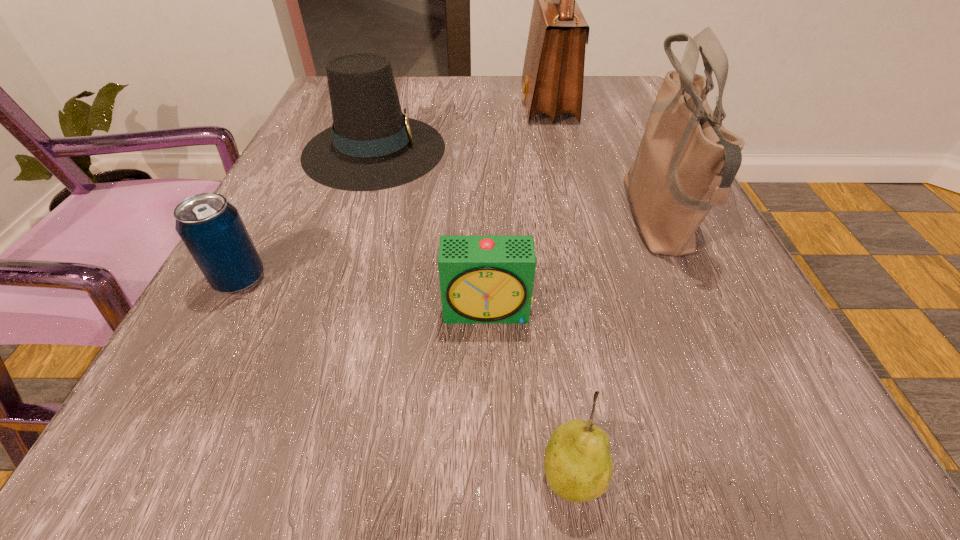
Where is `vacant region between the nearest object and the farther shoulder bag`? vacant region between the nearest object and the farther shoulder bag is located at coordinates (559, 289).

Locate an element on the screen. free space between the alarm clock and the pear is located at coordinates (529, 393).

This screenshot has width=960, height=540. Identify the location of free spot between the left shoulder bag and the alarm clock. (517, 207).

Image resolution: width=960 pixels, height=540 pixels. Find the location of `unoccupied area between the hat and the left shoulder bag`. unoccupied area between the hat and the left shoulder bag is located at coordinates (461, 126).

Where is `blank region between the left shoulder bag and the alarm clock`? This screenshot has height=540, width=960. blank region between the left shoulder bag and the alarm clock is located at coordinates (517, 207).

Where is `vacant space in between the nearer shoulder bag and the pear`? vacant space in between the nearer shoulder bag and the pear is located at coordinates (614, 347).

The height and width of the screenshot is (540, 960). Find the location of `free space between the soda can and the nearest object`. free space between the soda can and the nearest object is located at coordinates (405, 377).

At what (x,y) coordinates should I click in order to perform the action: click on empty space that is in between the nearest object and the nearer shoulder bag. Please return your answer as a coordinate pair (x, y). The height and width of the screenshot is (540, 960). Looking at the image, I should click on (614, 347).

Locate an element on the screen. object that ranks as the fifth closest to the nearer shoulder bag is located at coordinates (211, 228).

Identify which object is located as the fourth nearest to the right shoulder bag. Please provide its 2D coordinates. Your answer should be formatted as a tuple, i.e. [(x, y)], where the tuple contains the x and y coordinates of a point satisfying the conditions above.

[(372, 145)]